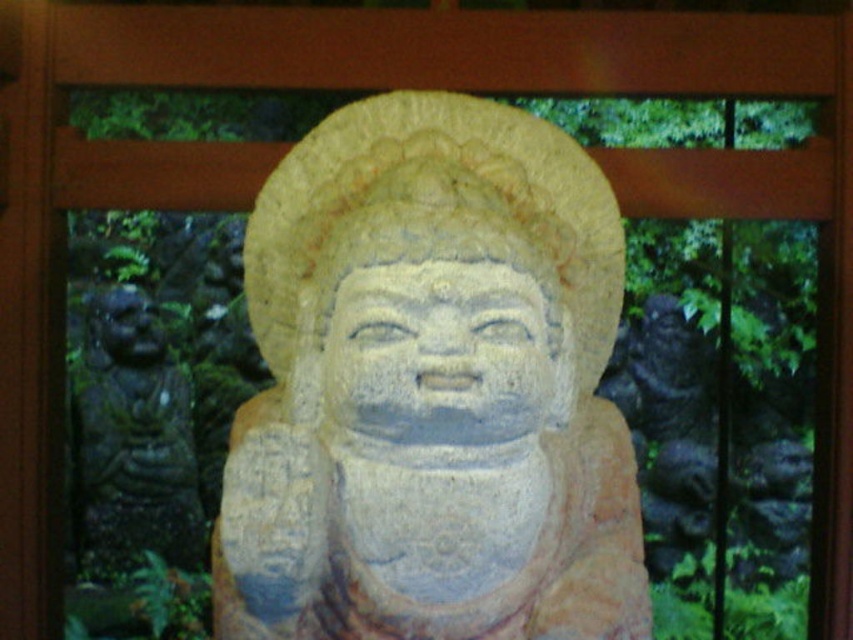
Is yellow stone statue at center to the right of dark gray stone statue at left from the viewer's perspective?

Correct, you'll find yellow stone statue at center to the right of dark gray stone statue at left.

Does yellow stone statue at center lie behind dark gray stone statue at left?

No, it is in front of dark gray stone statue at left.

Between point (358, 218) and point (134, 465), which one is positioned behind?

Positioned behind is point (134, 465).

The width and height of the screenshot is (853, 640). I want to click on yellow stone statue at center, so click(434, 205).

Which of these two, smooth stone statue at center or dark gray stone statue at left, stands taller?

smooth stone statue at center

Can you confirm if smooth stone statue at center is bigger than dark gray stone statue at left?

Indeed, smooth stone statue at center has a larger size compared to dark gray stone statue at left.

This screenshot has height=640, width=853. What do you see at coordinates (432, 388) in the screenshot?
I see `smooth stone statue at center` at bounding box center [432, 388].

Identify the location of smooth stone statue at center. (432, 388).

How much distance is there between smooth stone statue at center and yellow stone statue at center?

smooth stone statue at center is 5.92 centimeters from yellow stone statue at center.

Who is more distant from viewer, (486, 520) or (421, 108)?

The point (421, 108) is behind.

This screenshot has height=640, width=853. Identify the location of smooth stone statue at center. (432, 388).